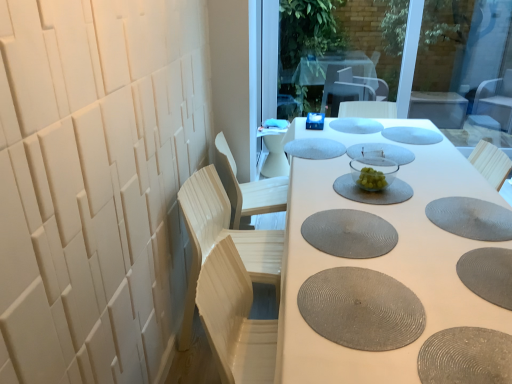
Image resolution: width=512 pixels, height=384 pixels. Find the location of `vacant region in front of gray textured placemat at center, the ninth manhole cover when ordered from back to front`. vacant region in front of gray textured placemat at center, the ninth manhole cover when ordered from back to front is located at coordinates (376, 364).